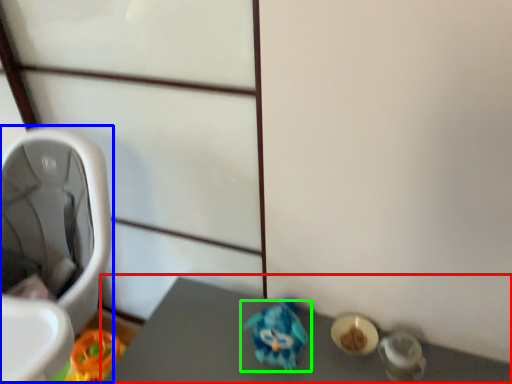
Question: Considering the real-world distances, which object is closest to vanity (highlighted by a red box)? baby carriage (highlighted by a blue box) or toy (highlighted by a green box).

Choices:
 (A) baby carriage
 (B) toy

Answer: (B)